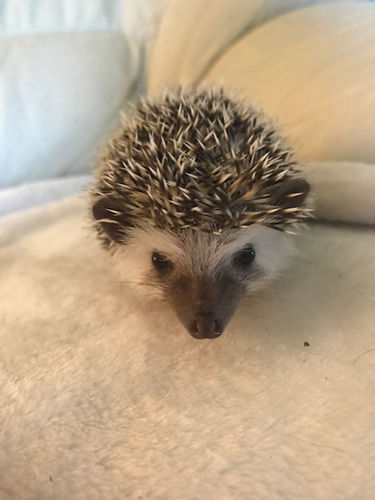
Identify the location of fold in cushion. This screenshot has height=500, width=375. (355, 164), (237, 38).